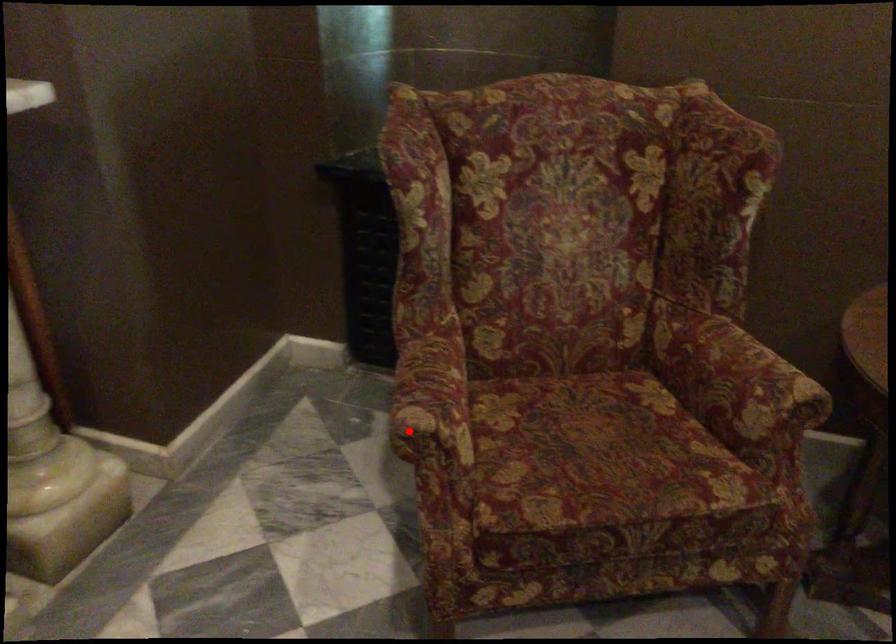
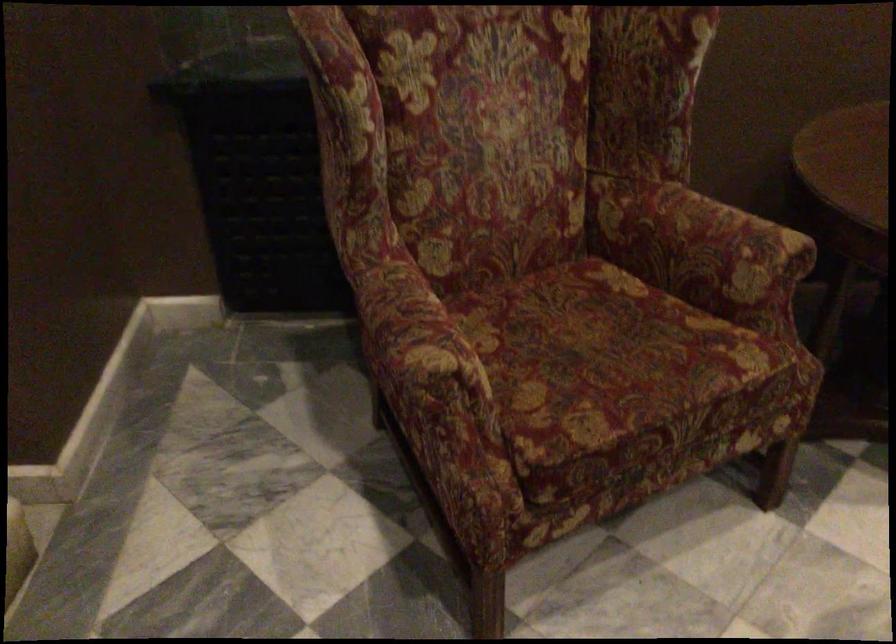
In the second image, find the point that corresponds to the highlighted location in the first image.

(428, 377)